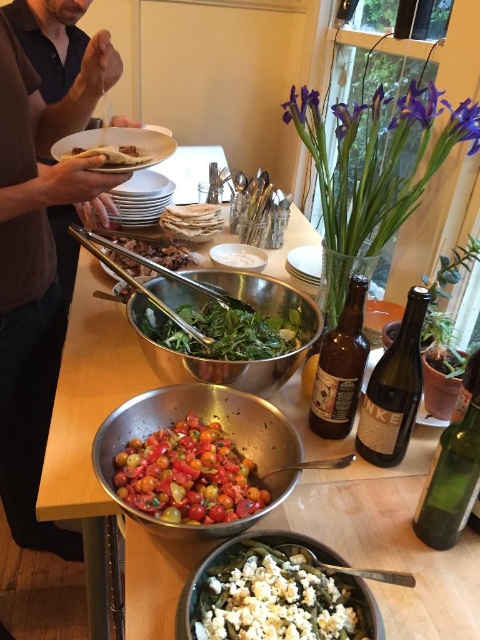
You are a chef arranging a platter and need to place both the shiny red tomatoes at center and the green leafy salad at center. Which one should you place first if you want to stack them vertically?

The shiny red tomatoes at center is taller than the green leafy salad at center, so you should place the shiny red tomatoes at center first to ensure stability when stacking them vertically.

You are setting up a table for a dinner party and need to place a centerpiece. The metallic silver bowl at center currently holds a salad. If you want to move the salad to the green glass bottle at lower right, will the bottle be visible from the main dining area?

The metallic silver bowl at center is in front of the green glass bottle at lower right, so moving the salad to the bottle would leave the bottle visible from the main dining area since it would no longer be blocked by the bowl.